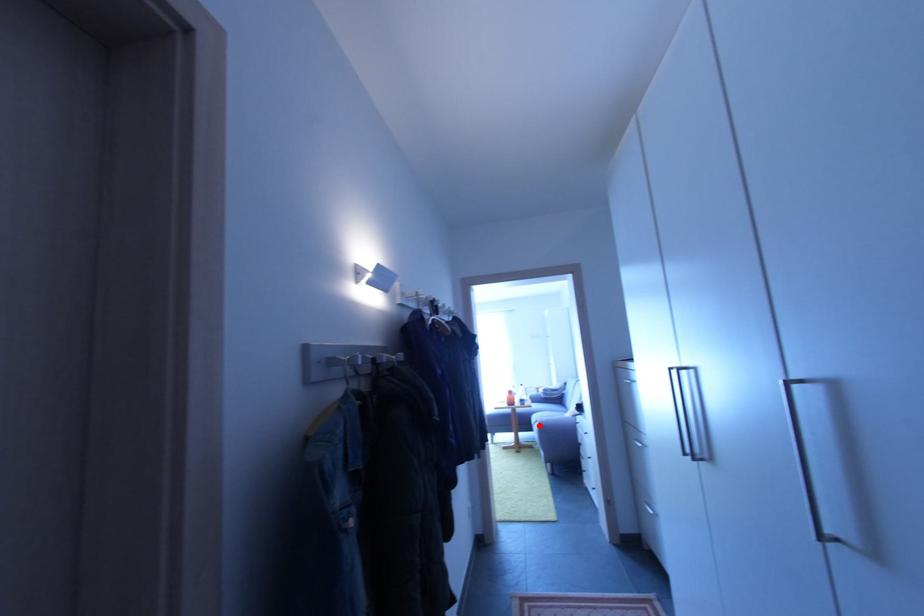
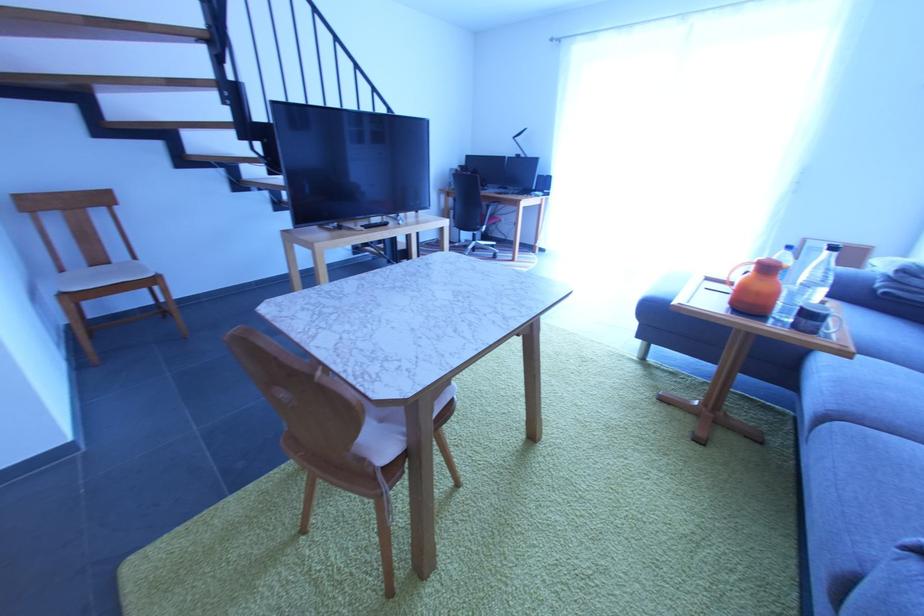
Find the pixel in the second image that matches the highlighted location in the first image.

(833, 419)